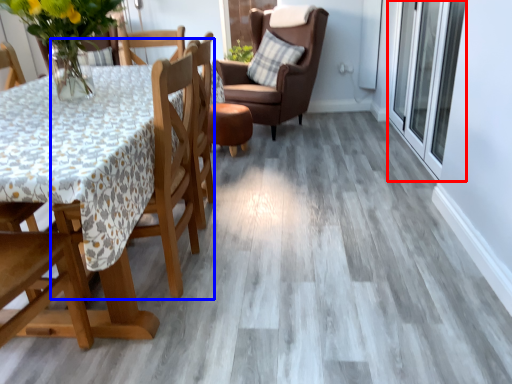
Question: Which object appears farthest to the camera in this image, screen door (highlighted by a red box) or chair (highlighted by a blue box)?

Choices:
 (A) screen door
 (B) chair

Answer: (A)